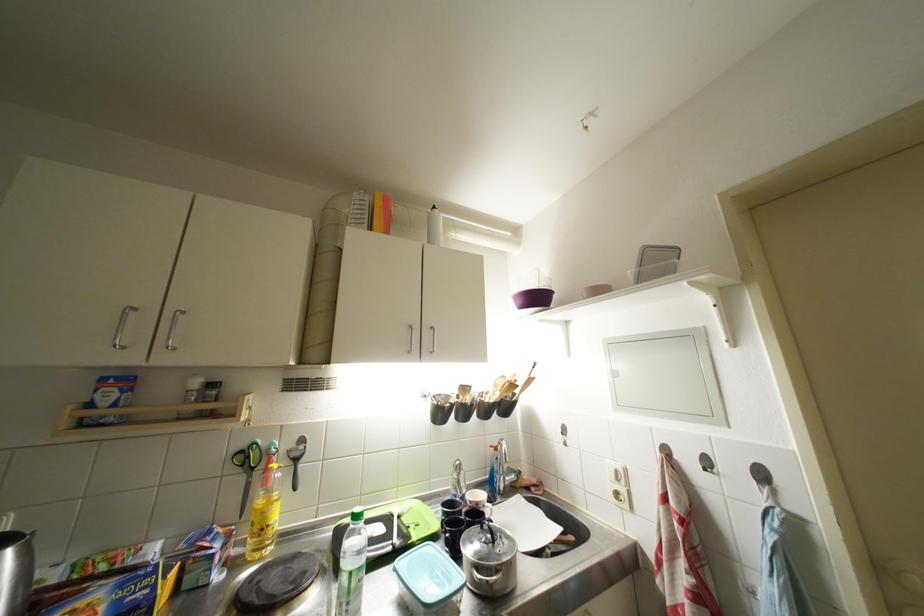
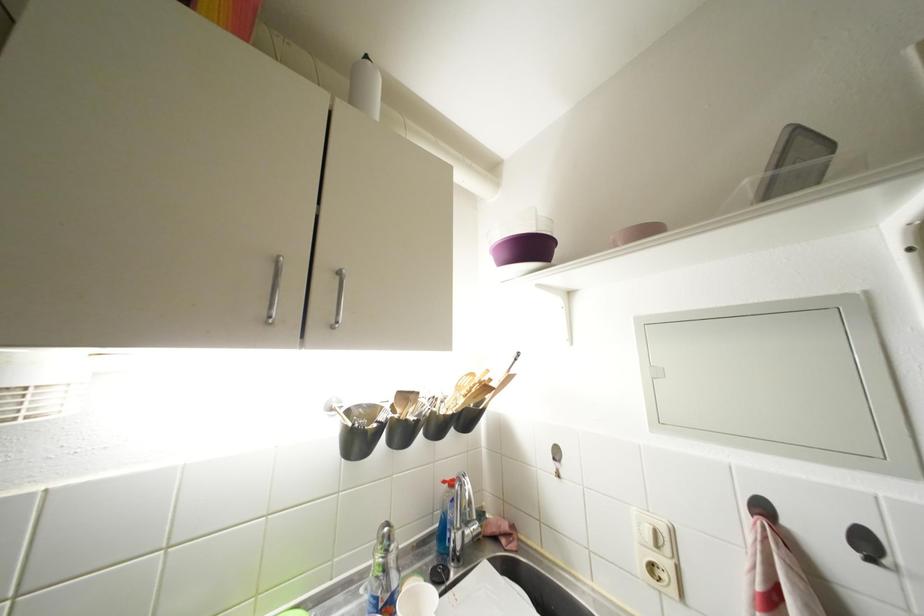
Where in the second image is the point corresponding to the point at 527,306 from the first image?

(512, 259)